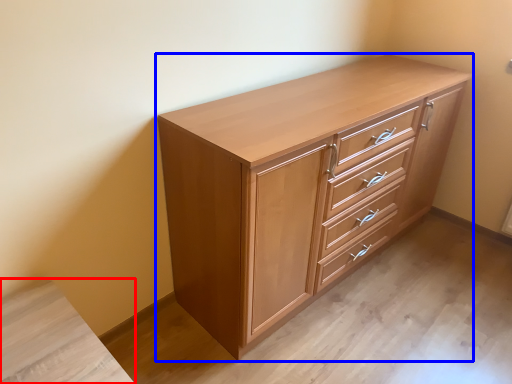
Question: Which object is further to the camera taking this photo, vanity (highlighted by a red box) or chest of drawers (highlighted by a blue box)?

Choices:
 (A) vanity
 (B) chest of drawers

Answer: (B)